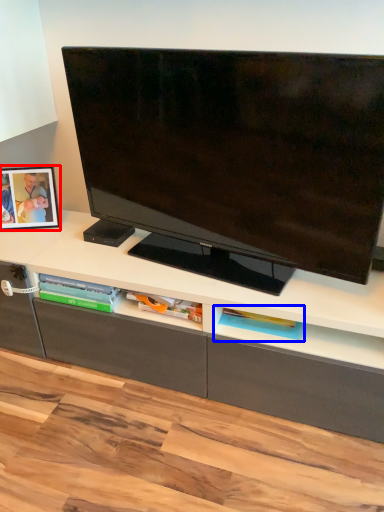
Question: Which point is closer to the camera, picture frame (highlighted by a red box) or shelf (highlighted by a blue box)?

Choices:
 (A) picture frame
 (B) shelf

Answer: (B)